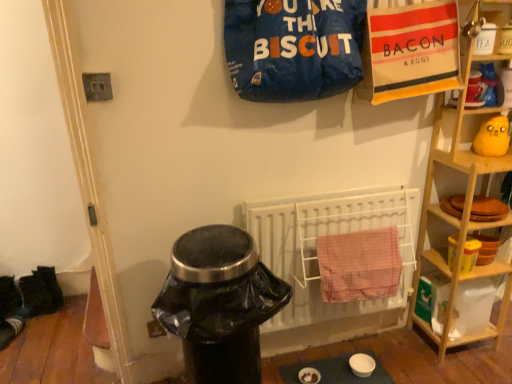
This screenshot has width=512, height=384. What do you see at coordinates (359, 265) in the screenshot?
I see `pink checkered towel at center` at bounding box center [359, 265].

This screenshot has width=512, height=384. What are the coordinates of `pink checkered towel at center` in the screenshot? It's located at (359, 265).

This screenshot has height=384, width=512. Find the location of `blue fabric sack at upper center`. blue fabric sack at upper center is located at coordinates (293, 48).

Where is `matte blue table at lower center`? The width and height of the screenshot is (512, 384). matte blue table at lower center is located at coordinates 336,371.

Describe the element at coordinates (336, 371) in the screenshot. The image size is (512, 384). I see `matte blue table at lower center` at that location.

The image size is (512, 384). Identify the location of pink checkered towel at center. (359, 265).

Does matte blue table at lower center turn towards wooden shelf at right?

No, matte blue table at lower center is not turned towards wooden shelf at right.

From the image's perspective, is matte blue table at lower center positioned above or below wooden shelf at right?

Clearly, from the image's perspective, matte blue table at lower center is below wooden shelf at right.

How distant is matte blue table at lower center from wooden shelf at right?

matte blue table at lower center and wooden shelf at right are 27.98 inches apart from each other.

Considering the sizes of objects white fabric sock at lower left, the 1th footwear from the front, and black plastic trash can at lower center in the image provided, who is shorter, white fabric sock at lower left, the 1th footwear from the front, or black plastic trash can at lower center?

With less height is white fabric sock at lower left, the 1th footwear from the front.

Measure the distance between white fabric sock at lower left, the 1th footwear from the front, and black plastic trash can at lower center.

They are 4.75 feet apart.

From the black plastic trash can at lower center, count 1st footwears backward and point to it. Please provide its 2D coordinates.

[(10, 330)]

From the image's perspective, would you say white fabric sock at lower left, the 1th footwear from the front, is shown under black plastic trash can at lower center?

Indeed, from the image's perspective, white fabric sock at lower left, the 1th footwear from the front, is shown beneath black plastic trash can at lower center.

The image size is (512, 384). I want to click on footwear that is the 2nd one when counting downward from the pink checkered towel at center (from the image's perspective), so click(x=10, y=330).

Considering the positions of points (19, 319) and (324, 247), is point (19, 319) farther from camera compared to point (324, 247)?

Yes, it is.

Are white fabric sock at lower left, the 1th footwear from the front, and pink checkered towel at center making contact?

There is a gap between white fabric sock at lower left, the 1th footwear from the front, and pink checkered towel at center.

From a real-world perspective, is white fabric sock at lower left, the 1th footwear from the front, below pink checkered towel at center?

Yes, from a real-world perspective, white fabric sock at lower left, the 1th footwear from the front, is under pink checkered towel at center.

Which object is positioned more to the left, wooden shelf at right or white metal radiator at center?

From the viewer's perspective, white metal radiator at center appears more on the left side.

Can you confirm if wooden shelf at right is bigger than white metal radiator at center?

Yes, wooden shelf at right is bigger than white metal radiator at center.

Could you tell me if wooden shelf at right is facing white metal radiator at center?

No.

In the image, is wooden shelf at right positioned in front of or behind white metal radiator at center?

Visually, wooden shelf at right is located in front of white metal radiator at center.

Looking at this image, considering the positions of objects wooden shelf at right and black plastic trash can at lower center in the image provided, who is behind, wooden shelf at right or black plastic trash can at lower center?

wooden shelf at right is behind.

Is wooden shelf at right to the left or to the right of black plastic trash can at lower center in the image?

wooden shelf at right is to the right of black plastic trash can at lower center.

From a real-world perspective, which object rests below the other?

black plastic trash can at lower center.

Between black fabric shoes at lower left, placed as the first footwear when sorted from back to front, and white fabric sock at lower left, which is counted as the second footwear, starting from the top, which one has larger size?

With larger size is black fabric shoes at lower left, placed as the first footwear when sorted from back to front.

Is white fabric sock at lower left, the 1th footwear from the front, inside black fabric shoes at lower left, marked as the second footwear in a front-to-back arrangement?

That's incorrect, white fabric sock at lower left, the 1th footwear from the front, is not inside black fabric shoes at lower left, marked as the second footwear in a front-to-back arrangement.

From the picture: From a real-world perspective, is black fabric shoes at lower left, the 1th footwear when ordered from top to bottom, positioned under white fabric sock at lower left, which is counted as the second footwear, starting from the top, based on gravity?

No, from a real-world perspective, black fabric shoes at lower left, the 1th footwear when ordered from top to bottom, is not under white fabric sock at lower left, which is counted as the second footwear, starting from the top.

Is blue fabric sack at upper center bigger or smaller than white fabric sock at lower left, the 1th footwear from the front?

Clearly, blue fabric sack at upper center is larger in size than white fabric sock at lower left, the 1th footwear from the front.

Is blue fabric sack at upper center looking in the opposite direction of white fabric sock at lower left, which is counted as the second footwear, starting from the top?

blue fabric sack at upper center does not have its back to white fabric sock at lower left, which is counted as the second footwear, starting from the top.

Can you tell me how much blue fabric sack at upper center and white fabric sock at lower left, the 1th footwear from the front, differ in facing direction?

The angle between the facing direction of blue fabric sack at upper center and the facing direction of white fabric sock at lower left, the 1th footwear from the front, is 68.7 degrees.

From the picture: Is blue fabric sack at upper center taller than white fabric sock at lower left, which is counted as the second footwear, starting from the top?

Yes, blue fabric sack at upper center is taller than white fabric sock at lower left, which is counted as the second footwear, starting from the top.

Locate an element on the screen. The height and width of the screenshot is (384, 512). shelf in front of the matte blue table at lower center is located at coordinates (459, 217).

This screenshot has height=384, width=512. Find the location of `the 1st footwear behind the black plastic trash can at lower center`. the 1st footwear behind the black plastic trash can at lower center is located at coordinates (10, 330).

From the image, which object appears to be nearer to wooden shelf at right, black plastic trash can at lower center or matte blue table at lower center?

Based on the image, matte blue table at lower center appears to be nearer to wooden shelf at right.

Which object lies nearer to the anchor point pink checkered towel at center, white fabric sock at lower left, which is counted as the 1th footwear, starting from the bottom, or white metal radiator at center?

white metal radiator at center is closer to pink checkered towel at center.

Considering their positions, is pink checkered towel at center positioned closer to black plastic trash can at lower center than white fabric sock at lower left, which is counted as the 1th footwear, starting from the bottom?

pink checkered towel at center lies closer to black plastic trash can at lower center than the other object.

Based on their spatial positions, is blue fabric sack at upper center or black plastic trash can at lower center closer to white metal radiator at center?

black plastic trash can at lower center lies closer to white metal radiator at center than the other object.

Which object lies further to the anchor point matte blue table at lower center, black plastic trash can at lower center or blue fabric sack at upper center?

The object further to matte blue table at lower center is blue fabric sack at upper center.

Which object lies further to the anchor point white metal radiator at center, matte blue table at lower center or white fabric sock at lower left, the 1th footwear from the front?

Among the two, white fabric sock at lower left, the 1th footwear from the front, is located further to white metal radiator at center.

Considering their positions, is blue fabric sack at upper center positioned closer to matte blue table at lower center than white fabric sock at lower left, which is counted as the 1th footwear, starting from the bottom?

blue fabric sack at upper center lies closer to matte blue table at lower center than the other object.

When comparing their distances from pink checkered towel at center, does matte blue table at lower center or wooden shelf at right seem closer?

Among the two, wooden shelf at right is located nearer to pink checkered towel at center.

I want to click on beach towel between white metal radiator at center and matte blue table at lower center vertically, so point(359,265).

Where is `radiator between black fabric shoes at lower left, marked as the second footwear in a front-to-back arrangement, and pink checkered towel at center, in the horizontal direction`? This screenshot has height=384, width=512. radiator between black fabric shoes at lower left, marked as the second footwear in a front-to-back arrangement, and pink checkered towel at center, in the horizontal direction is located at coordinates (326, 235).

Locate an element on the screen. trash bin/can between blue fabric sack at upper center and matte blue table at lower center from top to bottom is located at coordinates (219, 304).

This screenshot has height=384, width=512. Find the location of `beach towel between black fabric shoes at lower left, placed as the second footwear when sorted from bottom to top, and wooden shelf at right from left to right`. beach towel between black fabric shoes at lower left, placed as the second footwear when sorted from bottom to top, and wooden shelf at right from left to right is located at coordinates (359, 265).